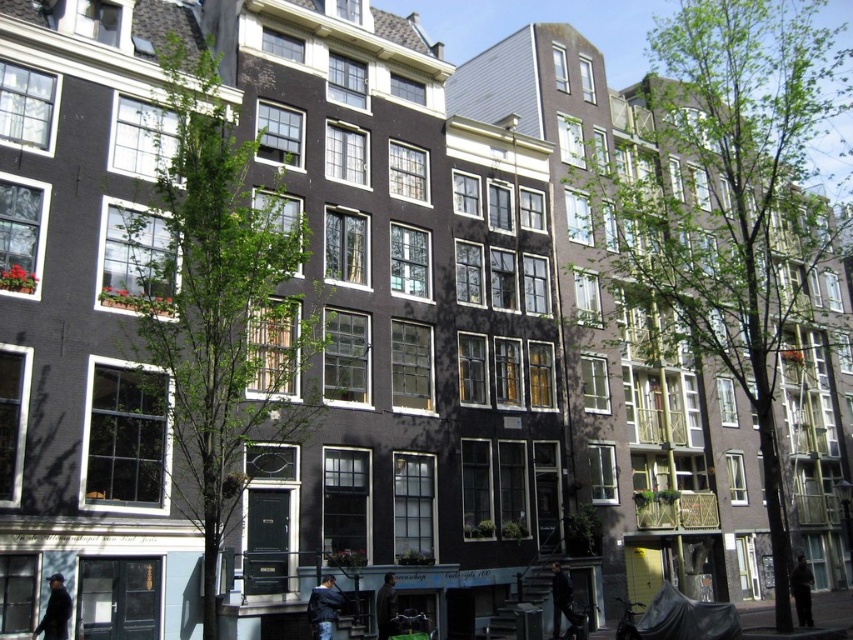
In the scene shown: You are a photographer standing in front of the Dutch buildings. You notice two jackets in the scene. If you want to take a photo that includes both the dark gray jacket at lower center and the dark brown leather jacket at lower right, which jacket should you adjust your camera angle to ensure the other is fully visible?

The dark gray jacket at lower center is in front of the dark brown leather jacket at lower right. To ensure the dark brown leather jacket at lower right is fully visible, you should adjust your camera angle to move it slightly behind the dark gray jacket at lower center.